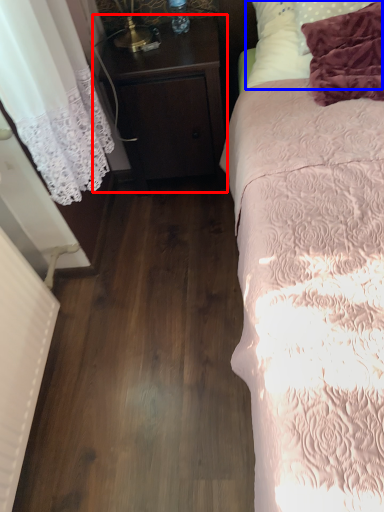
Question: Among these objects, which one is nearest to the camera, nightstand (highlighted by a red box) or pillow (highlighted by a blue box)?

Choices:
 (A) nightstand
 (B) pillow

Answer: (B)